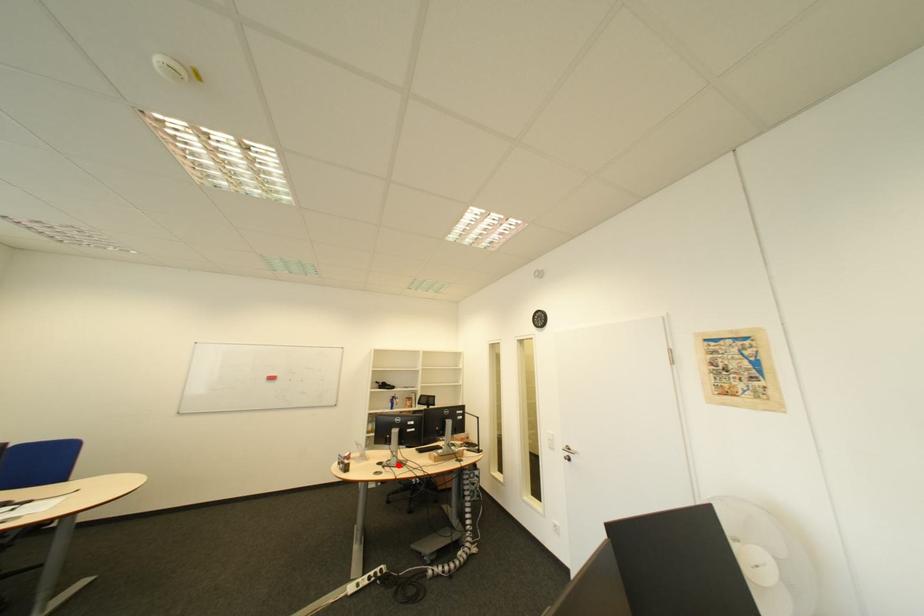
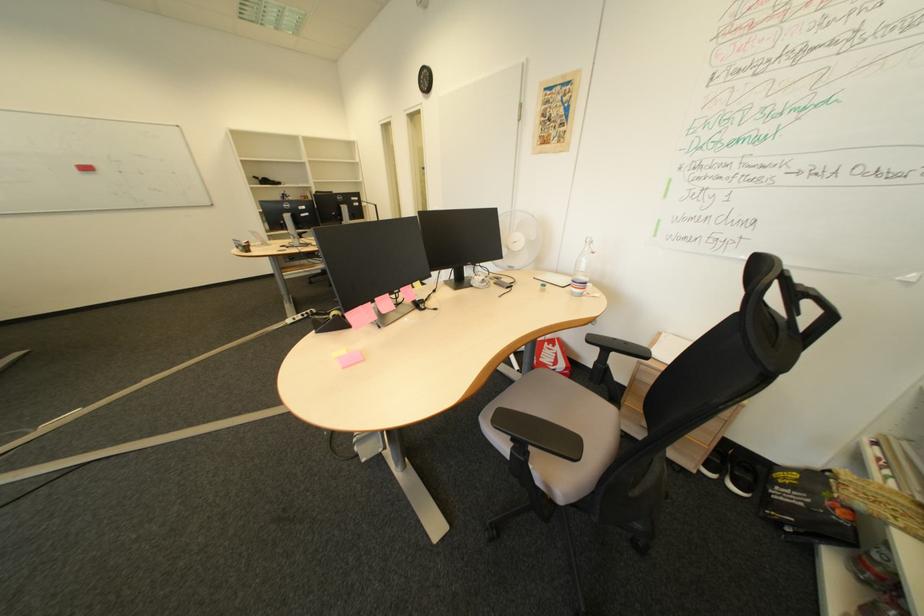
Locate, in the second image, the point that corresponds to the highlighted location in the first image.

(301, 246)